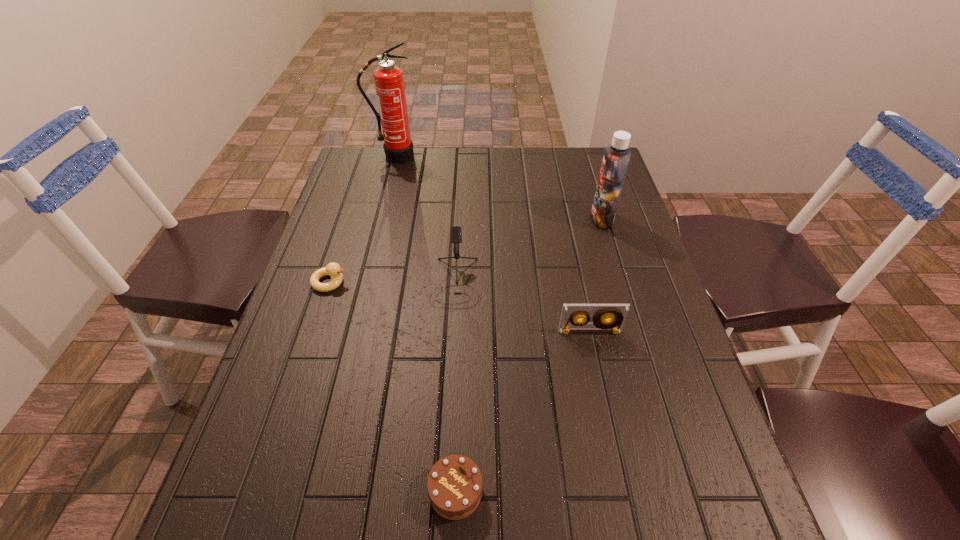
Where is `duckling located in the left edge section of the desktop`? Image resolution: width=960 pixels, height=540 pixels. duckling located in the left edge section of the desktop is located at coordinates (332, 269).

Image resolution: width=960 pixels, height=540 pixels. Find the location of `shampoo that is positioned at the right edge`. shampoo that is positioned at the right edge is located at coordinates (616, 158).

Locate an element on the screen. The image size is (960, 540). videotape positioned at the right edge is located at coordinates (616, 313).

What are the coordinates of `object present at the far left corner` in the screenshot? It's located at (389, 83).

Where is `vacant region at the far edge of the desktop`? This screenshot has width=960, height=540. vacant region at the far edge of the desktop is located at coordinates (512, 177).

Locate an element on the screen. blank space at the left edge of the desktop is located at coordinates (368, 205).

At what (x,y) coordinates should I click in order to perform the action: click on free spot at the right edge of the desktop. Please return your answer as a coordinate pair (x, y). The width and height of the screenshot is (960, 540). Looking at the image, I should click on (602, 267).

In order to click on vacant space that's between the duckling and the nearest object in this screenshot , I will do `click(393, 387)`.

Where is `vacant area that lies between the fifth shortest object and the fourth shortest object`? vacant area that lies between the fifth shortest object and the fourth shortest object is located at coordinates (528, 250).

I want to click on empty space that is in between the fire extinguisher and the duckling, so click(x=362, y=219).